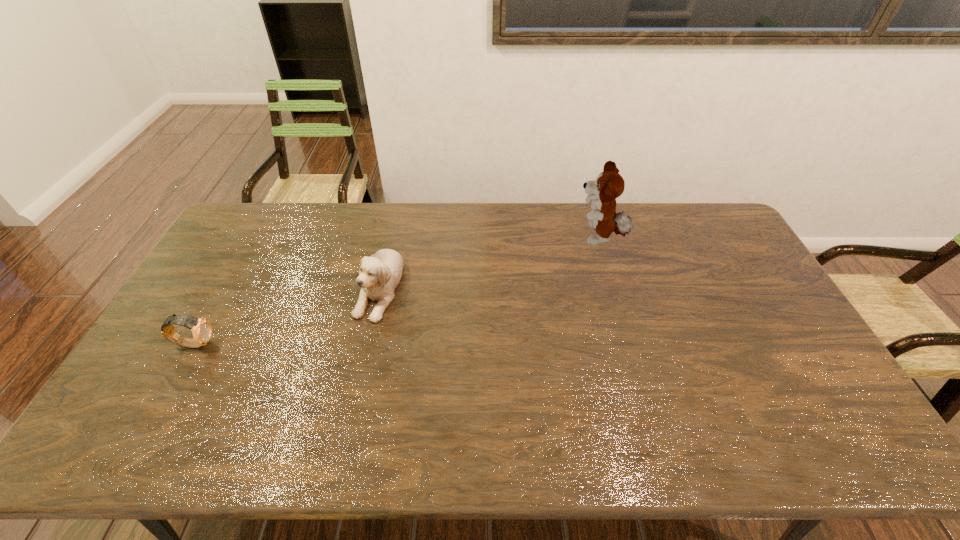
At what (x,y) coordinates should I click in order to perform the action: click on the tallest object. Please return your answer as a coordinate pair (x, y). This screenshot has width=960, height=540. Looking at the image, I should click on (609, 185).

Find the location of `the rightmost object`. the rightmost object is located at coordinates (609, 185).

This screenshot has height=540, width=960. I want to click on the shorter puppy, so click(x=379, y=275).

Locate an element on the screen. the left puppy is located at coordinates (379, 275).

What are the coordinates of `the leftmost object` in the screenshot? It's located at (201, 329).

Find the location of `the shortest object`. the shortest object is located at coordinates (201, 329).

Find the location of a particular element. Image resolution: width=960 pixels, height=540 pixels. vacant position located on the face of the rightmost object is located at coordinates (543, 239).

Find the location of `free space located on the face of the rightmost object`. free space located on the face of the rightmost object is located at coordinates (479, 239).

Locate an element on the screen. This screenshot has width=960, height=540. vacant region located on the face of the rightmost object is located at coordinates (538, 239).

This screenshot has height=540, width=960. Find the location of `blank area located 0.190m on the front-facing side of the second object from left to right`. blank area located 0.190m on the front-facing side of the second object from left to right is located at coordinates (357, 381).